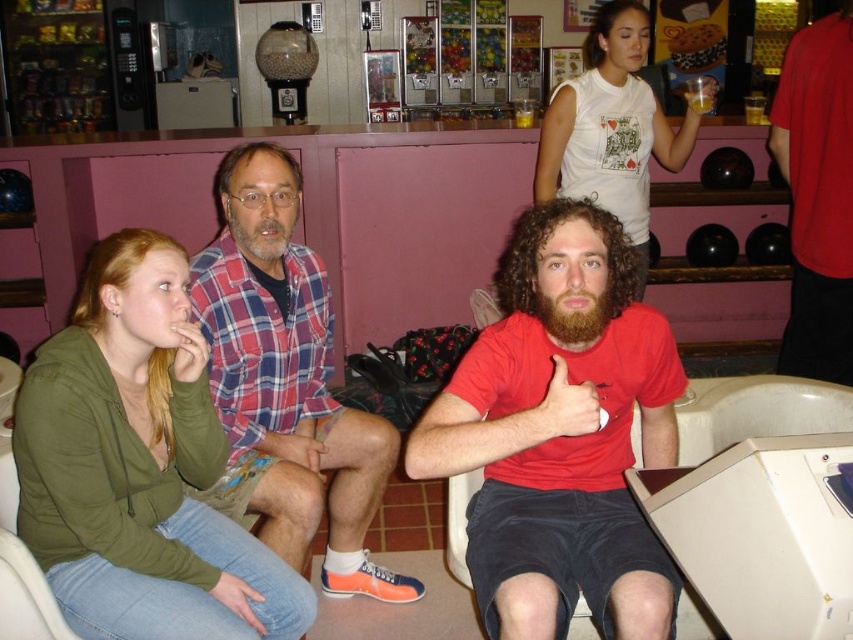
Question: Does red matte t-shirt at center have a smaller size compared to white cotton t-shirt at upper center?

Choices:
 (A) yes
 (B) no

Answer: (A)

Question: Which object is the farthest from the matte green hoodie at lower left?

Choices:
 (A) red matte t-shirt at center
 (B) red matte shirt at upper right
 (C) plaid shirt at center
 (D) white cotton t-shirt at upper center

Answer: (B)

Question: Is the position of plaid shirt at center less distant than that of white cotton t-shirt at upper center?

Choices:
 (A) yes
 (B) no

Answer: (A)

Question: Which of the following is the closest to the observer?

Choices:
 (A) plaid shirt at center
 (B) white cotton t-shirt at upper center
 (C) red matte shirt at upper right

Answer: (A)

Question: Considering the real-world distances, which object is closest to the plaid shirt at center?

Choices:
 (A) red matte t-shirt at center
 (B) white cotton t-shirt at upper center

Answer: (A)

Question: Does plaid shirt at center appear under white cotton t-shirt at upper center?

Choices:
 (A) yes
 (B) no

Answer: (A)